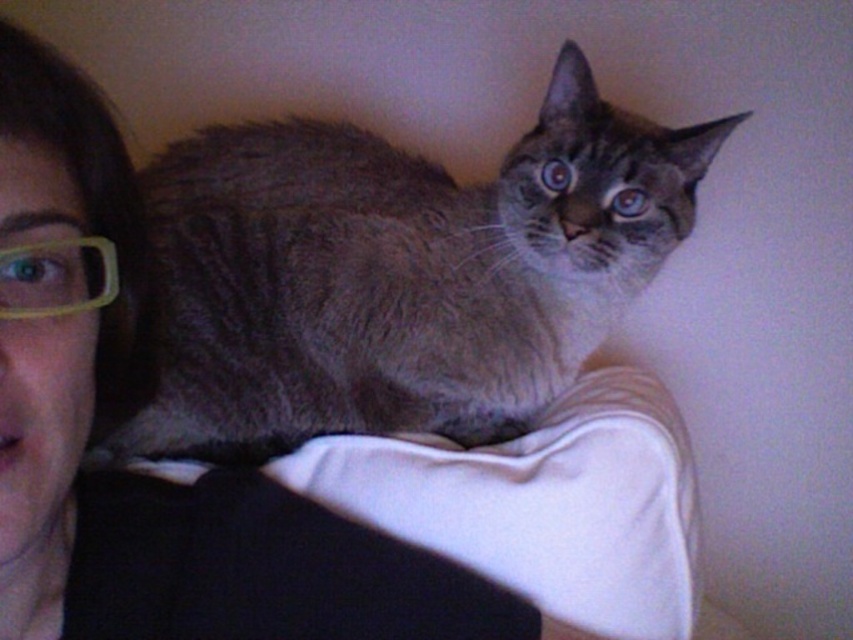
Does gray fur cat at center have a greater height compared to yellow plastic glasses at left?

Yes, gray fur cat at center is taller than yellow plastic glasses at left.

Is point (253, 352) less distant than point (82, 296)?

No, (253, 352) is further to viewer.

The image size is (853, 640). What are the coordinates of `gray fur cat at center` in the screenshot? It's located at (398, 273).